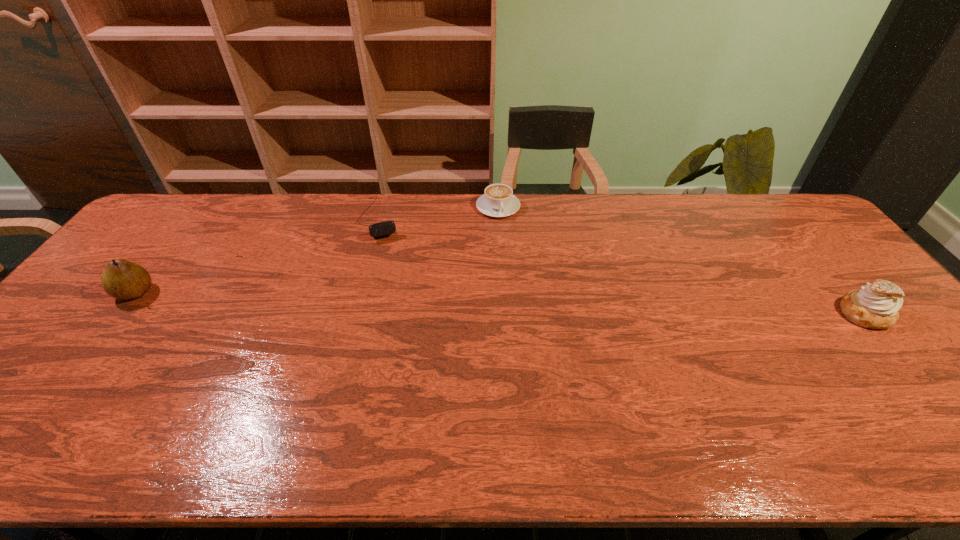
Image resolution: width=960 pixels, height=540 pixels. Find the location of `free space on the desktop that is between the leftmost object and the pastry and is positioned on the side of the cappuccino with the handle`. free space on the desktop that is between the leftmost object and the pastry and is positioned on the side of the cappuccino with the handle is located at coordinates (532, 305).

I want to click on vacant space on the desktop that is between the leftmost object and the pastry and is positioned on the front-facing side of the webcam, so click(x=409, y=301).